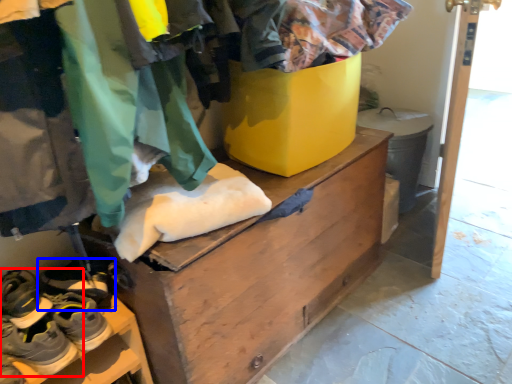
Question: Which point is further to the camera, footwear (highlighted by a red box) or footwear (highlighted by a blue box)?

Choices:
 (A) footwear
 (B) footwear

Answer: (B)